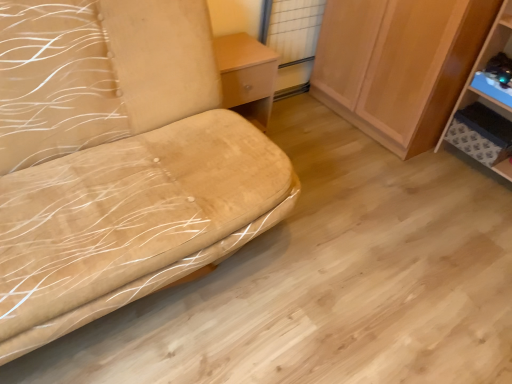
Question: From the image's perspective, is wooden cabinet at right above or below suede-like beige sofa at left?

Choices:
 (A) below
 (B) above

Answer: (B)

Question: Is wooden cabinet at right in front of or behind suede-like beige sofa at left in the image?

Choices:
 (A) front
 (B) behind

Answer: (B)

Question: Which is nearer to the wooden cabinet at right?

Choices:
 (A) suede-like beige sofa at left
 (B) blue plastic shelf at right
 (C) light wood/texture table at center

Answer: (B)

Question: Which object is the closest to the light wood/texture table at center?

Choices:
 (A) wooden cabinet at right
 (B) suede-like beige sofa at left
 (C) blue plastic shelf at right

Answer: (B)